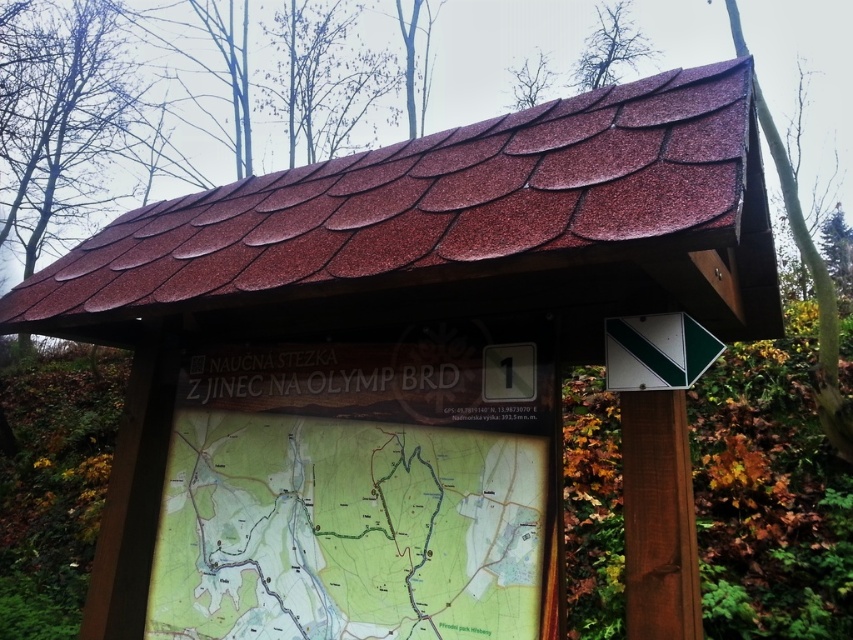
Question: Is green matte map at center to the right of green plastic sign at upper right from the viewer's perspective?

Choices:
 (A) no
 (B) yes

Answer: (A)

Question: Can you confirm if green matte map at center is positioned to the left of green plastic sign at upper right?

Choices:
 (A) no
 (B) yes

Answer: (B)

Question: Which of the following is the farthest from the observer?

Choices:
 (A) (665, 342)
 (B) (212, 538)

Answer: (B)

Question: Can you confirm if green matte map at center is wider than green plastic sign at upper right?

Choices:
 (A) no
 (B) yes

Answer: (B)